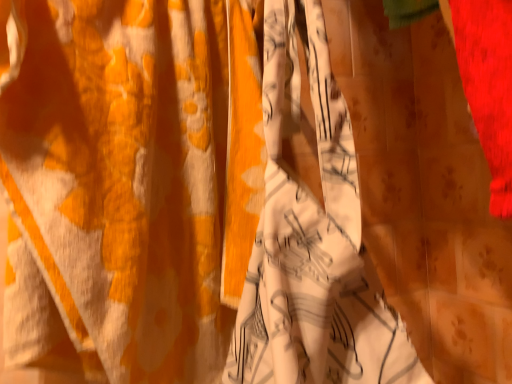
Question: Is white printed fabric at center taller than white printed fabric at center?

Choices:
 (A) yes
 (B) no

Answer: (B)

Question: Can we say white printed fabric at center lies outside white printed fabric at center?

Choices:
 (A) yes
 (B) no

Answer: (A)

Question: Would you consider white printed fabric at center to be distant from white printed fabric at center?

Choices:
 (A) no
 (B) yes

Answer: (A)

Question: Can you confirm if white printed fabric at center is positioned to the right of white printed fabric at center?

Choices:
 (A) no
 (B) yes

Answer: (B)

Question: Is white printed fabric at center facing towards white printed fabric at center?

Choices:
 (A) yes
 (B) no

Answer: (B)

Question: From the image's perspective, is white printed fabric at center over white printed fabric at center?

Choices:
 (A) yes
 (B) no

Answer: (B)

Question: Can you confirm if white printed fabric at center is shorter than white printed fabric at center?

Choices:
 (A) yes
 (B) no

Answer: (B)

Question: From the image's perspective, is white printed fabric at center beneath white printed fabric at center?

Choices:
 (A) yes
 (B) no

Answer: (B)

Question: Is white printed fabric at center wider than white printed fabric at center?

Choices:
 (A) no
 (B) yes

Answer: (A)

Question: From the image's perspective, is white printed fabric at center on top of white printed fabric at center?

Choices:
 (A) yes
 (B) no

Answer: (A)

Question: Is white printed fabric at center aimed at white printed fabric at center?

Choices:
 (A) yes
 (B) no

Answer: (A)

Question: Is the surface of white printed fabric at center in direct contact with white printed fabric at center?

Choices:
 (A) no
 (B) yes

Answer: (A)

Question: From their relative heights in the image, would you say white printed fabric at center is taller or shorter than white printed fabric at center?

Choices:
 (A) short
 (B) tall

Answer: (B)